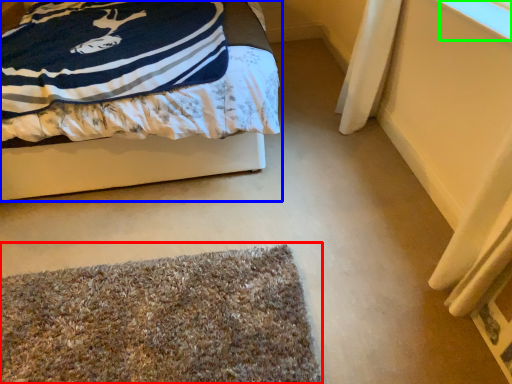
Question: Estimate the real-world distances between objects in this image. Which object is farther from mat (highlighted by a red box), bed (highlighted by a blue box) or window screen (highlighted by a green box)?

Choices:
 (A) bed
 (B) window screen

Answer: (B)